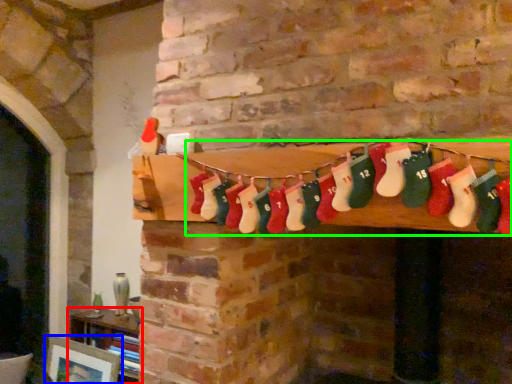
Question: Considering the real-world distances, which object is closest to furniture (highlighted by a red box)? picture frame (highlighted by a blue box) or sock (highlighted by a green box).

Choices:
 (A) picture frame
 (B) sock

Answer: (A)